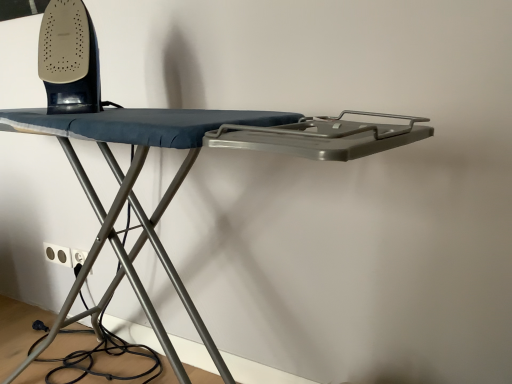
Question: Does white plastic electric outlet at lower left, the first electric outlet in the left-to-right sequence, lie in front of matte black iron at upper left?

Choices:
 (A) yes
 (B) no

Answer: (B)

Question: Can you confirm if white plastic electric outlet at lower left, which is the 2th electric outlet in right-to-left order, is smaller than matte black iron at upper left?

Choices:
 (A) no
 (B) yes

Answer: (B)

Question: From a real-world perspective, is white plastic electric outlet at lower left, which is the 2th electric outlet in right-to-left order, positioned under matte black iron at upper left based on gravity?

Choices:
 (A) no
 (B) yes

Answer: (B)

Question: From the image's perspective, is white plastic electric outlet at lower left, the first electric outlet in the left-to-right sequence, on matte black iron at upper left?

Choices:
 (A) yes
 (B) no

Answer: (B)

Question: Considering the relative positions of white plastic electric outlet at lower left, which is the 2th electric outlet in right-to-left order, and matte black iron at upper left in the image provided, is white plastic electric outlet at lower left, which is the 2th electric outlet in right-to-left order, to the right of matte black iron at upper left from the viewer's perspective?

Choices:
 (A) no
 (B) yes

Answer: (A)

Question: Looking at their shapes, would you say matte black iron at upper left is wider or thinner than white plastic electric outlet at lower left, which is counted as the 1th electric outlet, starting from the right?

Choices:
 (A) thin
 (B) wide

Answer: (B)

Question: From a real-world perspective, is matte black iron at upper left physically located above or below white plastic electric outlet at lower left, acting as the second electric outlet starting from the left?

Choices:
 (A) below
 (B) above

Answer: (B)

Question: Is point (45, 59) closer or farther from the camera than point (84, 256)?

Choices:
 (A) closer
 (B) farther

Answer: (A)

Question: In the image, is matte black iron at upper left positioned in front of or behind white plastic electric outlet at lower left, which is counted as the 1th electric outlet, starting from the right?

Choices:
 (A) behind
 (B) front

Answer: (B)

Question: From their relative heights in the image, would you say white plastic electric outlet at lower left, acting as the second electric outlet starting from the left, is taller or shorter than white plastic electric outlet at lower left, which is the 2th electric outlet in right-to-left order?

Choices:
 (A) tall
 (B) short

Answer: (A)

Question: Is point 73,258 closer or farther from the camera than point 67,256?

Choices:
 (A) farther
 (B) closer

Answer: (B)

Question: Is white plastic electric outlet at lower left, which is counted as the 1th electric outlet, starting from the right, wider or thinner than white plastic electric outlet at lower left, the first electric outlet in the left-to-right sequence?

Choices:
 (A) wide
 (B) thin

Answer: (A)

Question: From a real-world perspective, is white plastic electric outlet at lower left, acting as the second electric outlet starting from the left, physically located above or below white plastic electric outlet at lower left, the first electric outlet in the left-to-right sequence?

Choices:
 (A) below
 (B) above

Answer: (B)

Question: Considering the relative positions of white plastic electric outlet at lower left, which is counted as the 1th electric outlet, starting from the right, and matte black iron at upper left in the image provided, is white plastic electric outlet at lower left, which is counted as the 1th electric outlet, starting from the right, to the left or to the right of matte black iron at upper left?

Choices:
 (A) right
 (B) left

Answer: (B)

Question: In terms of height, does white plastic electric outlet at lower left, acting as the second electric outlet starting from the left, look taller or shorter compared to matte black iron at upper left?

Choices:
 (A) tall
 (B) short

Answer: (B)